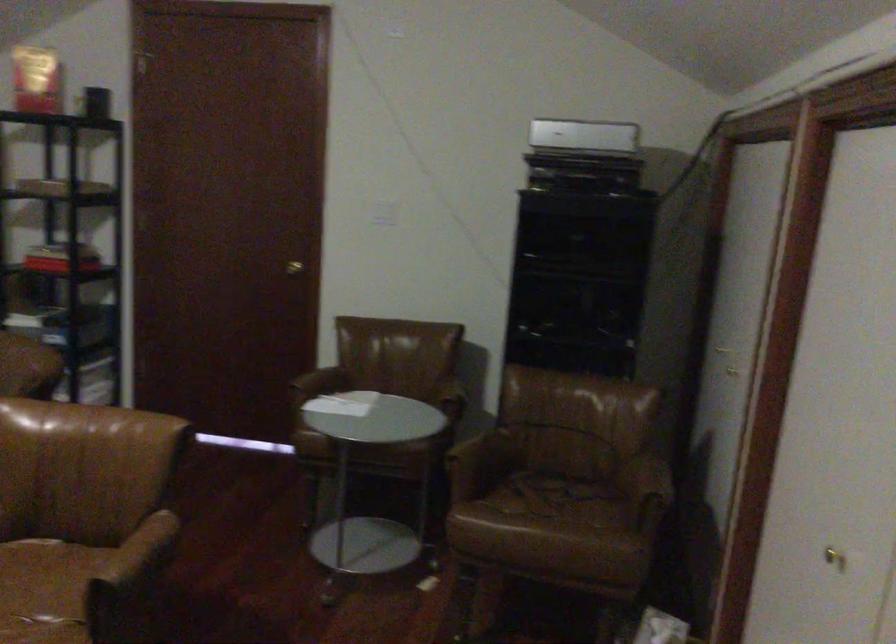
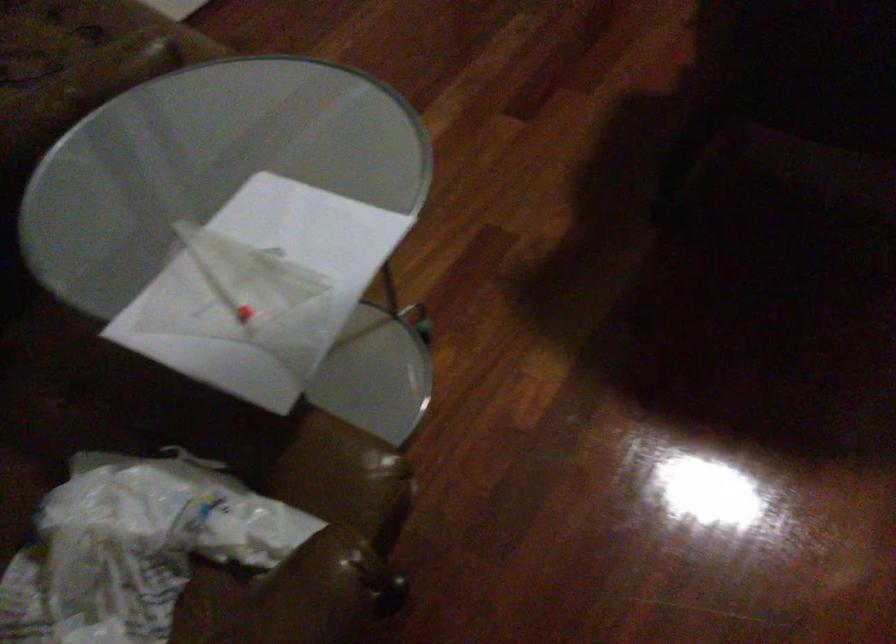
In the second image, find the point that corresponds to point 350,402 in the first image.

(134, 547)